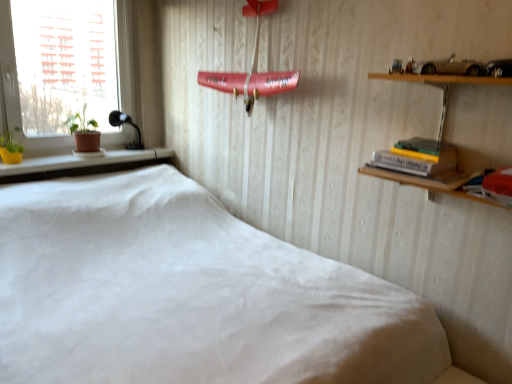
This screenshot has height=384, width=512. What are the coordinates of `vacant area located to the right-hand side of yellow matte plant at left` in the screenshot? It's located at (39, 162).